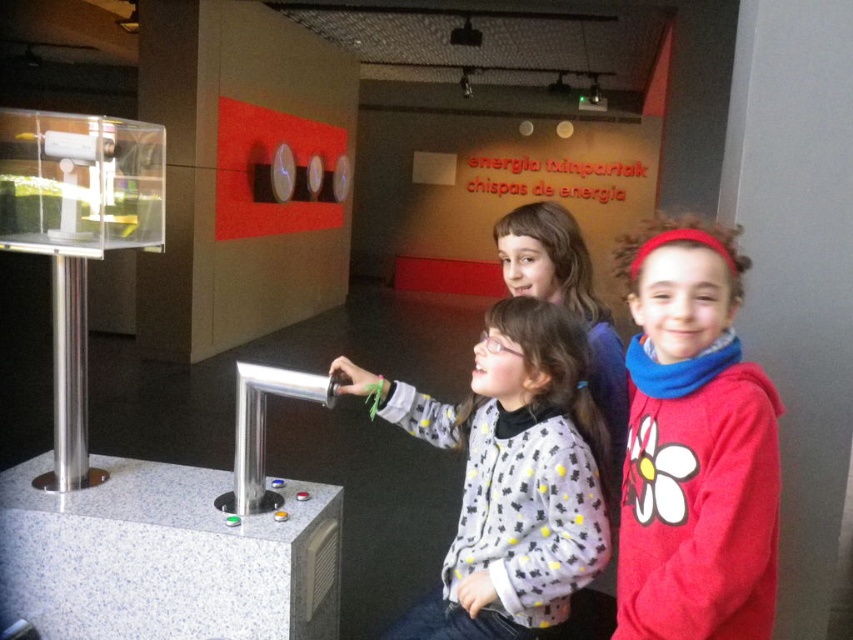
Question: Does red fleece jacket at center right appear on the right side of white matte sweater at center?

Choices:
 (A) no
 (B) yes

Answer: (B)

Question: Does red fleece jacket at center right appear on the right side of white matte sweater at center?

Choices:
 (A) no
 (B) yes

Answer: (B)

Question: Which point is closer to the camera taking this photo?

Choices:
 (A) (756, 454)
 (B) (503, 541)

Answer: (A)

Question: Which point is closer to the camera?

Choices:
 (A) red fleece jacket at center right
 (B) white matte sweater at center

Answer: (A)

Question: Is red fleece jacket at center right bigger than white matte sweater at center?

Choices:
 (A) yes
 (B) no

Answer: (B)

Question: Which point is closer to the camera taking this photo?

Choices:
 (A) (453, 552)
 (B) (755, 465)

Answer: (B)